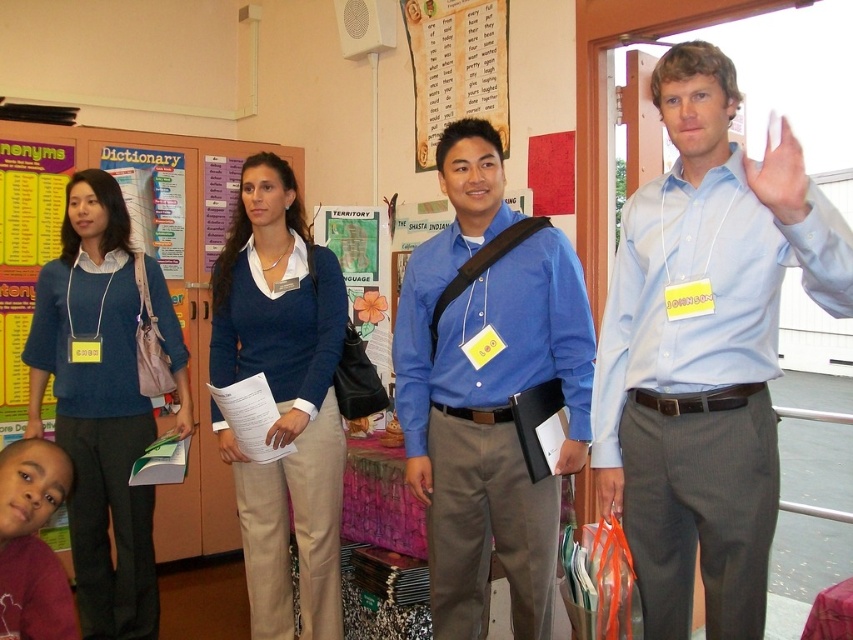
Question: Is red cotton shirt at lower left above white paper at center?

Choices:
 (A) no
 (B) yes

Answer: (A)

Question: Which point is closer to the camera taking this photo?

Choices:
 (A) (509, 308)
 (B) (42, 275)
 (C) (62, 582)
 (D) (36, 419)

Answer: (C)

Question: Can you confirm if blue sweater at left is smaller than white matte hand at upper right?

Choices:
 (A) no
 (B) yes

Answer: (A)

Question: Is light blue shirt at center smaller than blue sweater at center?

Choices:
 (A) no
 (B) yes

Answer: (A)

Question: Which object is the farthest from the white matte hand at upper right?

Choices:
 (A) light blue shirt at center
 (B) white paper at center
 (C) matte blue shirt at center
 (D) blue smooth shirt at center

Answer: (B)

Question: Which point is farther to the camera?

Choices:
 (A) (718, 104)
 (B) (422, 483)
 (C) (593, 477)
 (D) (496, 339)

Answer: (C)